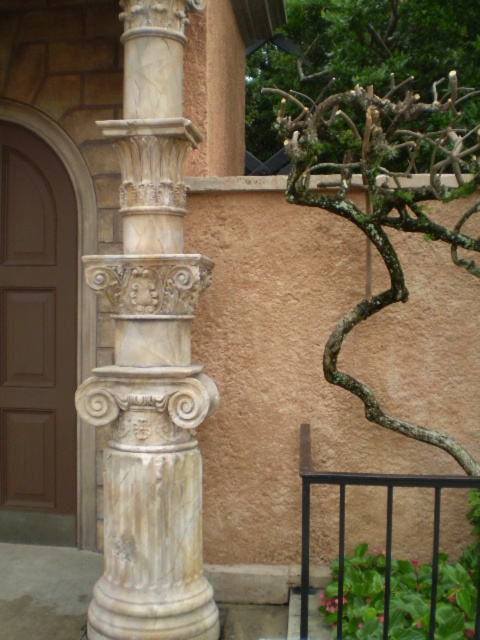
You are an architect designing a new building and want to ensure that the white marble column at center will fit through a doorway that is the same width as the bare branches at upper right. Based on the image, will the column fit through the doorway?

The white marble column at center is narrower than the bare branches at upper right, so it should fit through the doorway designed to match the branches width.

You are an architect inspecting the building facade. You notice the white marble column at center and the bare branches at upper right. Which object occupies more space in the scene?

The bare branches at upper right occupy more space in the scene since they are larger than the white marble column at center.